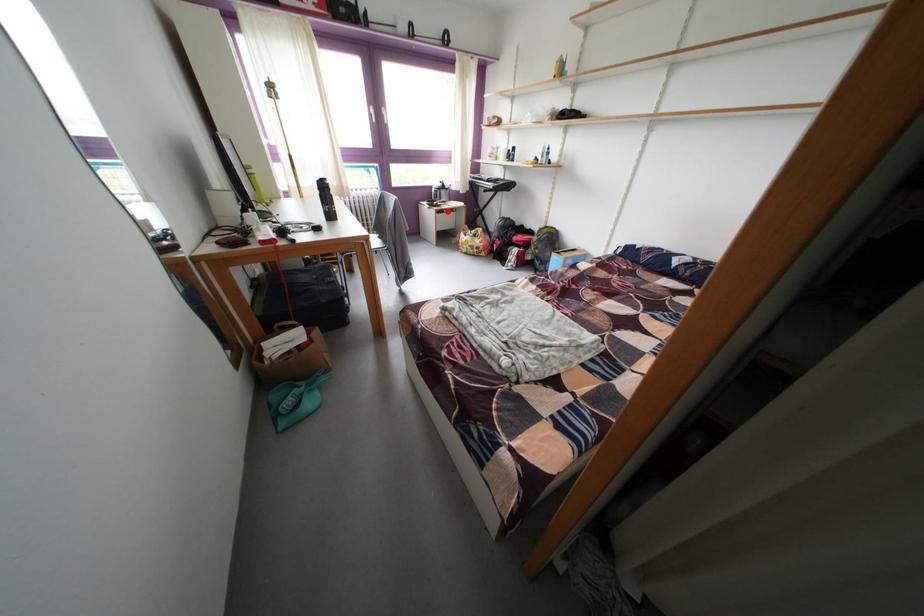
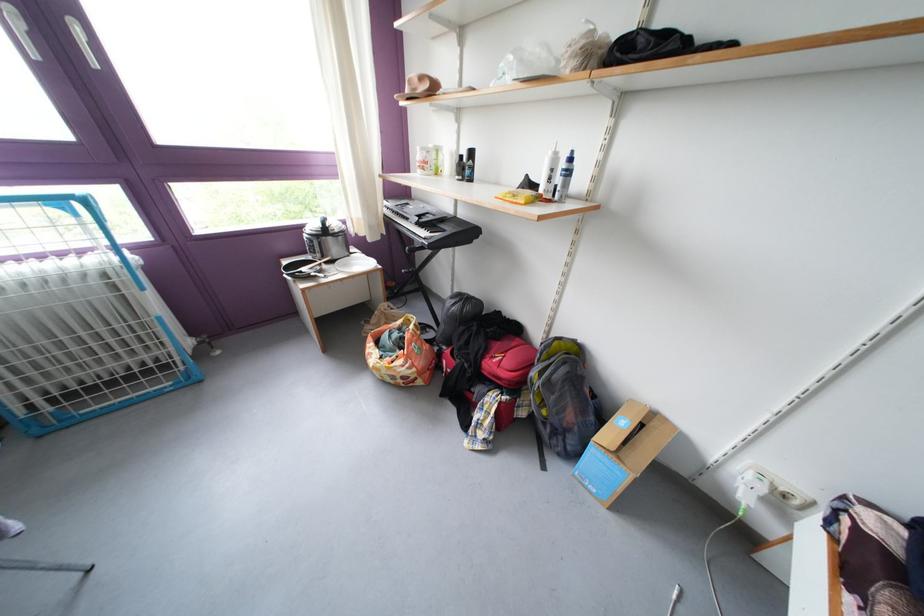
Where in the second image is the point corresponding to the highlighted location from the first image?

(319, 283)